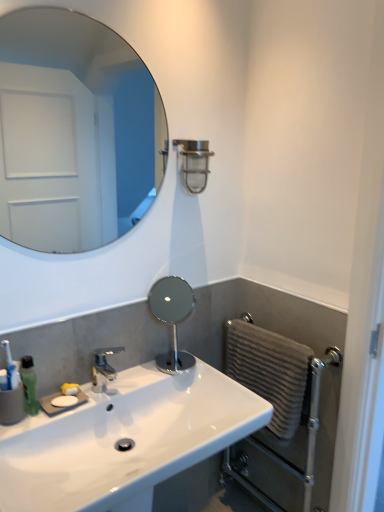
The height and width of the screenshot is (512, 384). Identify the location of vacant area that is situated to the right of silver metallic faucet at center. (152, 381).